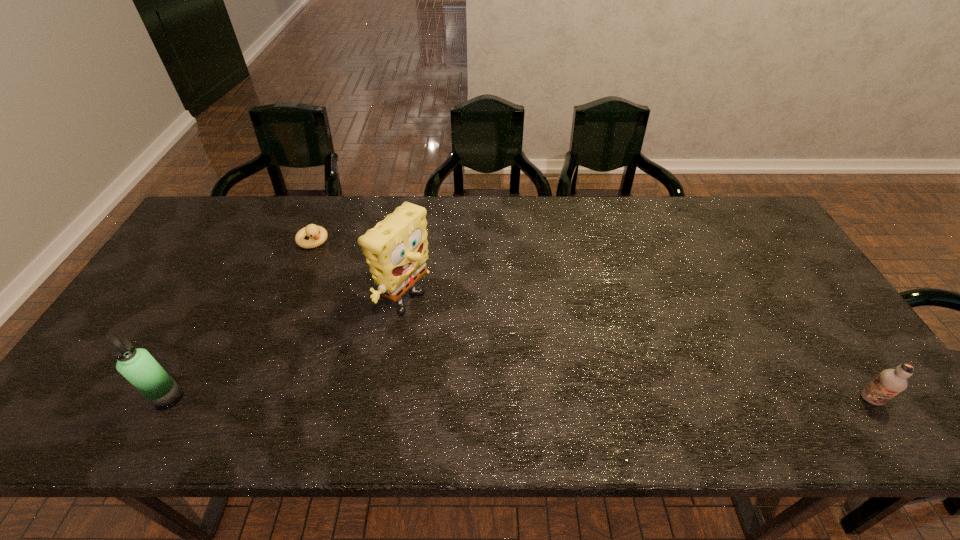
Where is `thermos bottle`? The width and height of the screenshot is (960, 540). thermos bottle is located at coordinates (137, 365).

The image size is (960, 540). Identify the location of the leftmost object. (137, 365).

Image resolution: width=960 pixels, height=540 pixels. I want to click on chocolate milk, so click(890, 382).

The width and height of the screenshot is (960, 540). I want to click on the third tallest object, so click(890, 382).

Where is `the tallest object`? the tallest object is located at coordinates (396, 250).

This screenshot has height=540, width=960. I want to click on the third object from left to right, so click(x=396, y=250).

Where is `the shortest object`? the shortest object is located at coordinates (317, 235).

In order to click on duckling in this screenshot , I will do `click(317, 235)`.

You are a GUI agent. You are given a task and a screenshot of the screen. Output one action in this format:
    pyautogui.click(x=<x>, y=<y>)
    Task: Click on the free space located on the right of the thermos bottle
    The width and height of the screenshot is (960, 540).
    Given the screenshot: What is the action you would take?
    (x=308, y=398)

Locate an element on the screen. The width and height of the screenshot is (960, 540). free space located on the back of the chocolate milk is located at coordinates (842, 357).